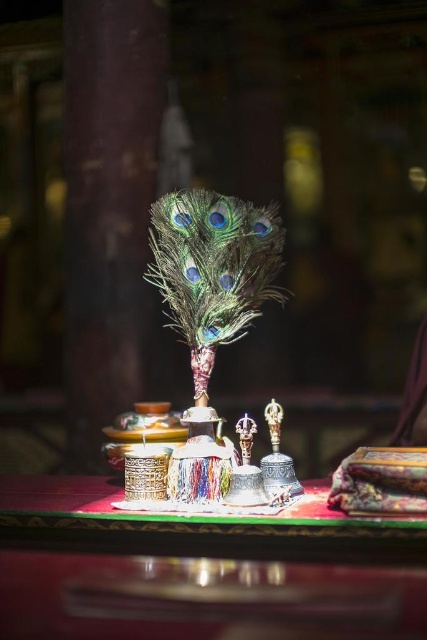
Question: Which of the following is the closest to the observer?

Choices:
 (A) metallic gold trophy at center
 (B) shiny dark wood table at center

Answer: (B)

Question: Does metallic gold trophy at center come in front of metallic bell at center?

Choices:
 (A) yes
 (B) no

Answer: (A)

Question: Which point is closer to the camera?

Choices:
 (A) metallic bell at center
 (B) metallic gold trophy at center

Answer: (B)

Question: Is shiny dark wood table at center below metallic gold trophy at center?

Choices:
 (A) no
 (B) yes

Answer: (B)

Question: Can you confirm if shiny dark wood table at center is positioned to the right of metallic bell at center?

Choices:
 (A) yes
 (B) no

Answer: (B)

Question: Which object is the farthest from the shiny dark wood table at center?

Choices:
 (A) metallic gold trophy at center
 (B) metallic bell at center

Answer: (B)